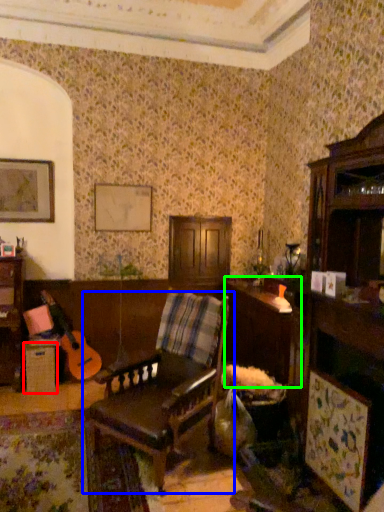
Question: Which is farther away from table (highlighted by a red box)? chair (highlighted by a blue box) or table (highlighted by a green box)?

Choices:
 (A) chair
 (B) table

Answer: (B)